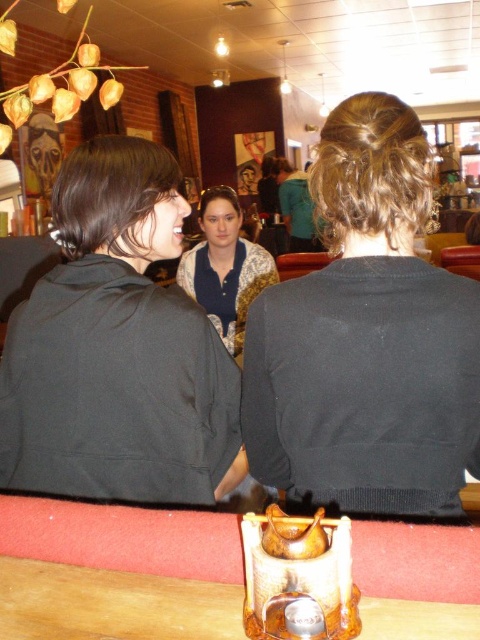
Question: From the image, what is the correct spatial relationship of black matte hair at center in relation to brown leather table at lower center?

Choices:
 (A) right
 (B) left

Answer: (A)

Question: Which object is the closest to the blue textured blouse at center?

Choices:
 (A) matte black hoodie at center
 (B) black matte hair at center

Answer: (A)

Question: Is brown leather table at lower center to the right of blue textured blouse at center from the viewer's perspective?

Choices:
 (A) no
 (B) yes

Answer: (B)

Question: Does matte black hoodie at center have a greater width compared to blue textured blouse at center?

Choices:
 (A) yes
 (B) no

Answer: (A)

Question: Which of the following is the closest to the observer?

Choices:
 (A) blue textured blouse at center
 (B) black matte hair at center
 (C) matte black hoodie at center

Answer: (B)

Question: Which of the following is the farthest from the observer?

Choices:
 (A) (372, 230)
 (B) (106, 577)
 (C) (253, 284)

Answer: (C)